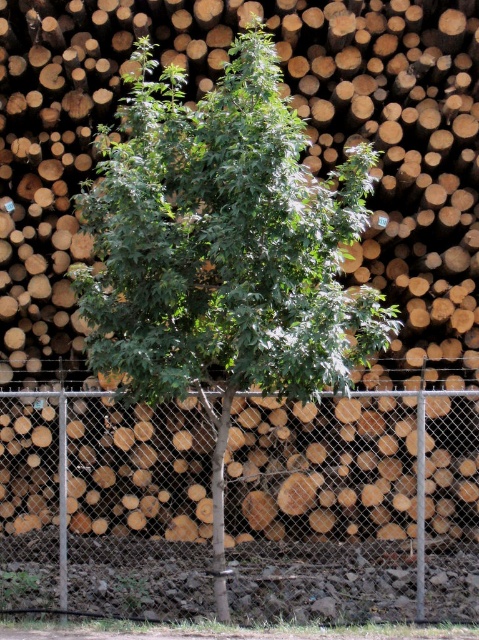
You are standing in a forest clearing and see the green leafy tree at center and the green matte tree trunk at center. Which object is positioned more to the right?

The green leafy tree at center is positioned more to the right than the green matte tree trunk at center.